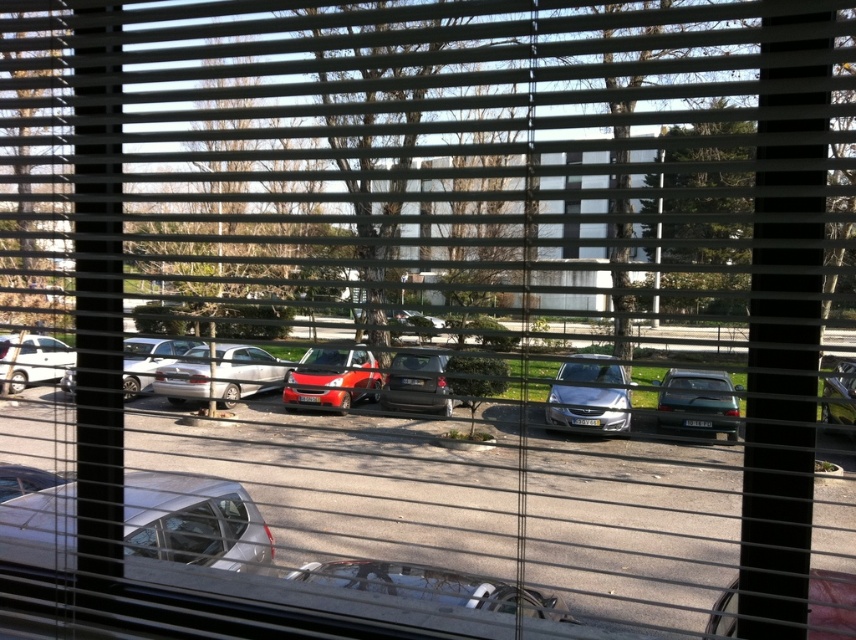
You are standing in a room with horizontal window blinds and looking at the parking lot outside. You see a silver metallic car at lower left and a matte silver sedan at center. Based on their positions relative to each other, which car is closer to the right edge of the window?

The silver metallic car at lower left is to the right of the matte silver sedan at center, so it is closer to the right edge of the window.